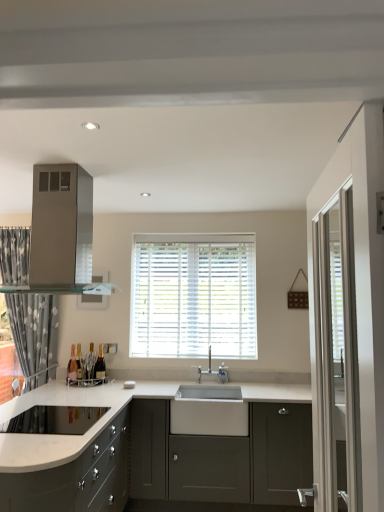
Question: Could matte gray cabinets at lower left, the 2th cabinetry positioned from the right, be considered to be inside matte gray cabinet at center, positioned as the 1th cabinetry in right-to-left order?

Choices:
 (A) no
 (B) yes

Answer: (A)

Question: Is the depth of matte gray cabinet at center, arranged as the second cabinetry when viewed from the left, less than that of matte gray cabinets at lower left, which is the 1th cabinetry in left-to-right order?

Choices:
 (A) yes
 (B) no

Answer: (B)

Question: Does matte gray cabinet at center, positioned as the 1th cabinetry in right-to-left order, appear on the left side of matte gray cabinets at lower left, which is the 1th cabinetry in left-to-right order?

Choices:
 (A) yes
 (B) no

Answer: (B)

Question: From the image's perspective, is matte gray cabinet at center, arranged as the second cabinetry when viewed from the left, on matte gray cabinets at lower left, the 2th cabinetry positioned from the right?

Choices:
 (A) no
 (B) yes

Answer: (A)

Question: From a real-world perspective, is matte gray cabinet at center, arranged as the second cabinetry when viewed from the left, beneath matte gray cabinets at lower left, which is the 1th cabinetry in left-to-right order?

Choices:
 (A) yes
 (B) no

Answer: (B)

Question: Is matte gray cabinet at center, arranged as the second cabinetry when viewed from the left, touching matte gray cabinets at lower left, the 2th cabinetry positioned from the right?

Choices:
 (A) no
 (B) yes

Answer: (A)

Question: From the image's perspective, would you say matte gray cabinets at lower left, which is the 1th cabinetry in left-to-right order, is shown under shiny dark glass wine bottle at lower left, marked as the first wine bottle in a right-to-left arrangement?

Choices:
 (A) yes
 (B) no

Answer: (A)

Question: Is shiny dark glass wine bottle at lower left, arranged as the second wine bottle when viewed from the left, inside matte gray cabinets at lower left, which is the 1th cabinetry in left-to-right order?

Choices:
 (A) no
 (B) yes

Answer: (B)

Question: Considering the relative sizes of matte gray cabinets at lower left, the 2th cabinetry positioned from the right, and shiny dark glass wine bottle at lower left, arranged as the second wine bottle when viewed from the left, in the image provided, is matte gray cabinets at lower left, the 2th cabinetry positioned from the right, smaller than shiny dark glass wine bottle at lower left, arranged as the second wine bottle when viewed from the left,?

Choices:
 (A) no
 (B) yes

Answer: (A)

Question: Considering the relative sizes of matte gray cabinets at lower left, which is the 1th cabinetry in left-to-right order, and shiny dark glass wine bottle at lower left, arranged as the second wine bottle when viewed from the left, in the image provided, is matte gray cabinets at lower left, which is the 1th cabinetry in left-to-right order, thinner than shiny dark glass wine bottle at lower left, arranged as the second wine bottle when viewed from the left,?

Choices:
 (A) no
 (B) yes

Answer: (A)

Question: Is matte gray cabinets at lower left, the 2th cabinetry positioned from the right, at the left side of shiny dark glass wine bottle at lower left, arranged as the second wine bottle when viewed from the left?

Choices:
 (A) yes
 (B) no

Answer: (A)

Question: From a real-world perspective, is matte gray cabinets at lower left, the 2th cabinetry positioned from the right, physically above shiny dark glass wine bottle at lower left, arranged as the second wine bottle when viewed from the left?

Choices:
 (A) no
 (B) yes

Answer: (A)

Question: Is white wood blinds at center to the right of satin silver range hood at upper left from the viewer's perspective?

Choices:
 (A) yes
 (B) no

Answer: (A)